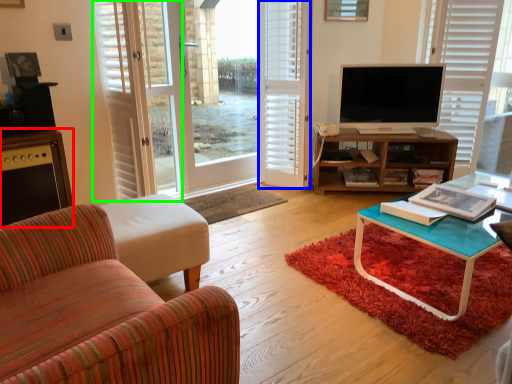
Question: Which is nearer to the cabinetry (highlighted by a red box)? shutter (highlighted by a blue box) or screen door (highlighted by a green box).

Choices:
 (A) shutter
 (B) screen door

Answer: (B)